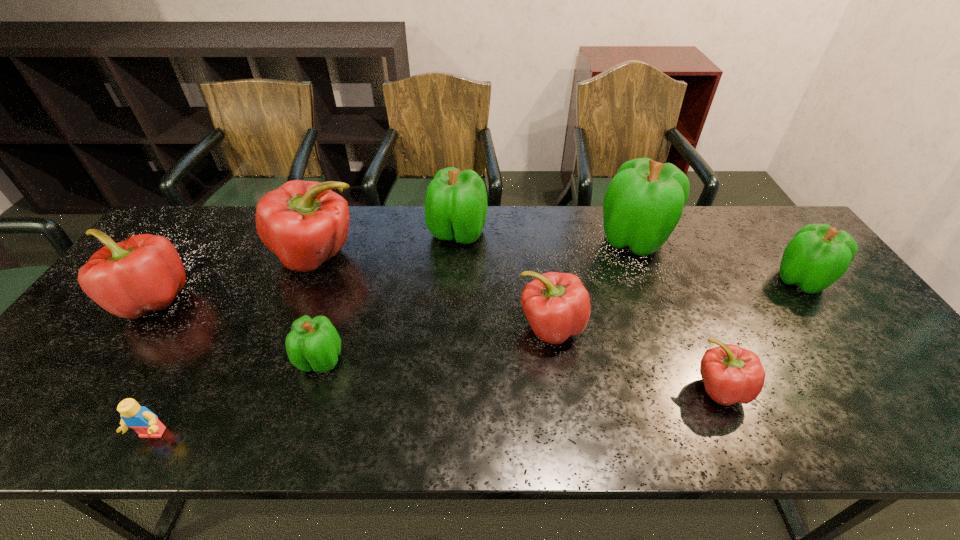
The height and width of the screenshot is (540, 960). What are the coordinates of `the biggest green bell pepper` in the screenshot? It's located at [643, 203].

At what (x,y) coordinates should I click in order to perform the action: click on the biggest pink bell pepper. Please return your answer as a coordinate pair (x, y). Image resolution: width=960 pixels, height=540 pixels. Looking at the image, I should click on (305, 223).

The image size is (960, 540). I want to click on the third green bell pepper from right to left, so click(x=456, y=204).

Locate an element on the screen. This screenshot has height=540, width=960. the fifth bell pepper from right to left is located at coordinates (456, 204).

Identify the location of the leftmost pink bell pepper. This screenshot has width=960, height=540. (143, 273).

The image size is (960, 540). What are the coordinates of `the leftmost bell pepper` in the screenshot? It's located at (143, 273).

In order to click on the rightmost bell pepper in this screenshot , I will do `click(818, 255)`.

You are a GUI agent. You are given a task and a screenshot of the screen. Output one action in this format:
    pyautogui.click(x=<x>, y=<y>)
    Task: Click on the rightmost green bell pepper
    Image resolution: width=960 pixels, height=540 pixels.
    Given the screenshot: What is the action you would take?
    pyautogui.click(x=818, y=255)

At what (x,y) coordinates should I click in order to perform the action: click on the second pink bell pepper from right to left. Please return your answer as a coordinate pair (x, y). Looking at the image, I should click on (557, 305).

The width and height of the screenshot is (960, 540). Find the location of `the fourth object from right to left`. the fourth object from right to left is located at coordinates (557, 305).